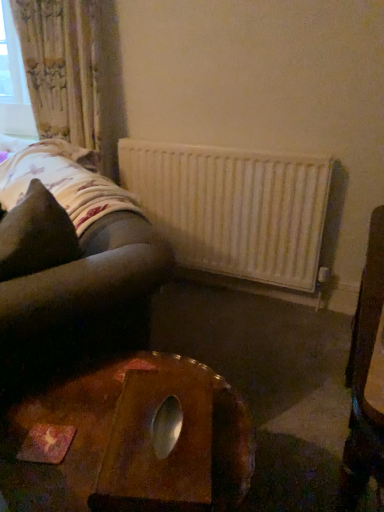
Question: Is brown fabric pillow at left positioned far away from floral fabric curtain at upper left?

Choices:
 (A) yes
 (B) no

Answer: (A)

Question: Can you confirm if brown fabric pillow at left is bigger than floral fabric curtain at upper left?

Choices:
 (A) no
 (B) yes

Answer: (A)

Question: From the image's perspective, is brown fabric pillow at left over floral fabric curtain at upper left?

Choices:
 (A) no
 (B) yes

Answer: (A)

Question: Considering the relative sizes of brown fabric pillow at left and floral fabric curtain at upper left in the image provided, is brown fabric pillow at left thinner than floral fabric curtain at upper left?

Choices:
 (A) no
 (B) yes

Answer: (A)

Question: From a real-world perspective, is brown fabric pillow at left beneath floral fabric curtain at upper left?

Choices:
 (A) yes
 (B) no

Answer: (A)

Question: Does point (263, 234) appear closer or farther from the camera than point (61, 1)?

Choices:
 (A) farther
 (B) closer

Answer: (A)

Question: Is white matte radiator at center in front of or behind floral fabric curtain at upper left in the image?

Choices:
 (A) front
 (B) behind

Answer: (A)

Question: In terms of height, does white matte radiator at center look taller or shorter compared to floral fabric curtain at upper left?

Choices:
 (A) short
 (B) tall

Answer: (A)

Question: From a real-world perspective, is white matte radiator at center above or below floral fabric curtain at upper left?

Choices:
 (A) above
 (B) below

Answer: (B)

Question: Is point (327, 159) positioned closer to the camera than point (8, 223)?

Choices:
 (A) closer
 (B) farther

Answer: (B)

Question: Considering the positions of white matte radiator at center and brown fabric pillow at left in the image, is white matte radiator at center taller or shorter than brown fabric pillow at left?

Choices:
 (A) short
 (B) tall

Answer: (B)

Question: Based on their positions, is white matte radiator at center located to the left or right of brown fabric pillow at left?

Choices:
 (A) right
 (B) left

Answer: (A)

Question: Is white matte radiator at center wider or thinner than brown fabric pillow at left?

Choices:
 (A) thin
 (B) wide

Answer: (A)

Question: From the image's perspective, relative to white matte radiator at center, is floral fabric curtain at upper left above or below?

Choices:
 (A) below
 (B) above

Answer: (B)

Question: Is floral fabric curtain at upper left spatially inside white matte radiator at center, or outside of it?

Choices:
 (A) outside
 (B) inside

Answer: (A)